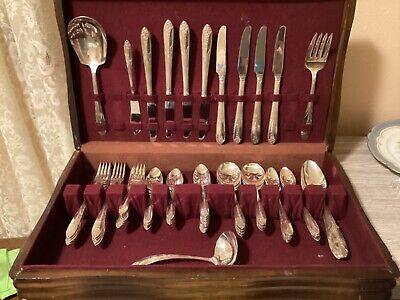
At what (x,y) coordinates should I click in order to perform the action: click on knives. Please return your answer as a coordinate pair (x, y). Image resolution: width=400 pixels, height=300 pixels. Looking at the image, I should click on (136, 119), (150, 116), (169, 115), (188, 115), (204, 117), (220, 118), (241, 117), (259, 120), (270, 119).